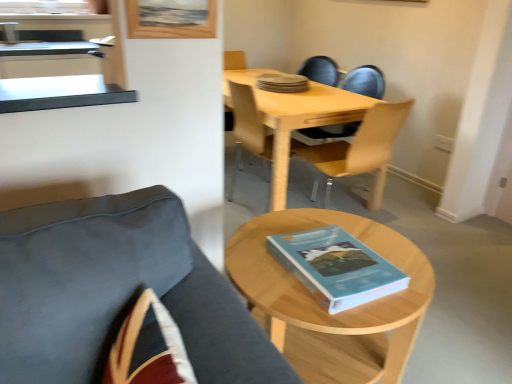
Question: Should I look upward or downward to see light wood/transparent plastic chair at center, the first chair in the back-to-front sequence?

Choices:
 (A) down
 (B) up

Answer: (B)

Question: Is wooden picture frame at upper center wider than light wood/wooden table at center?

Choices:
 (A) yes
 (B) no

Answer: (B)

Question: From the image's perspective, would you say wooden picture frame at upper center is shown under light wood/wooden table at center?

Choices:
 (A) yes
 (B) no

Answer: (B)

Question: Is wooden picture frame at upper center far away from light wood/wooden table at center?

Choices:
 (A) yes
 (B) no

Answer: (A)

Question: Can you confirm if wooden picture frame at upper center is shorter than light wood/wooden table at center?

Choices:
 (A) yes
 (B) no

Answer: (A)

Question: From a real-world perspective, is wooden picture frame at upper center beneath light wood/wooden table at center?

Choices:
 (A) no
 (B) yes

Answer: (A)

Question: From the image's perspective, does wooden picture frame at upper center appear higher than light wood/wooden table at center?

Choices:
 (A) no
 (B) yes

Answer: (B)

Question: Does light wood/transparent plastic chair at center, positioned as the third chair in front-to-back order, have a lesser height compared to wooden picture frame at upper center?

Choices:
 (A) yes
 (B) no

Answer: (B)

Question: Is light wood/transparent plastic chair at center, positioned as the third chair in front-to-back order, in front of wooden picture frame at upper center?

Choices:
 (A) no
 (B) yes

Answer: (A)

Question: Is wooden picture frame at upper center at the back of light wood/transparent plastic chair at center, the first chair in the back-to-front sequence?

Choices:
 (A) yes
 (B) no

Answer: (B)

Question: Can you confirm if light wood/transparent plastic chair at center, positioned as the third chair in front-to-back order, is positioned to the left of wooden picture frame at upper center?

Choices:
 (A) no
 (B) yes

Answer: (A)

Question: Does light wood/transparent plastic chair at center, positioned as the third chair in front-to-back order, turn towards wooden picture frame at upper center?

Choices:
 (A) no
 (B) yes

Answer: (A)

Question: Is wooden picture frame at upper center surrounded by light wood/transparent plastic chair at center, positioned as the third chair in front-to-back order?

Choices:
 (A) no
 (B) yes

Answer: (A)

Question: From a real-world perspective, does velvet dark blue chair at lower left, placed as the first chair when sorted from front to back, sit lower than blue matte book at center, the 1th book positioned from the front?

Choices:
 (A) no
 (B) yes

Answer: (B)